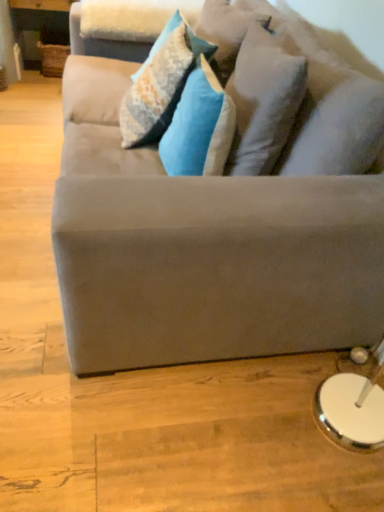
Question: Can you confirm if suede gray couch at center is thinner than textured blue pillow at center, which is the 2th pillow from right to left?

Choices:
 (A) yes
 (B) no

Answer: (B)

Question: Considering the relative sizes of suede gray couch at center and textured blue pillow at center, which is the 2th pillow from right to left, in the image provided, is suede gray couch at center bigger than textured blue pillow at center, which is the 2th pillow from right to left,?

Choices:
 (A) yes
 (B) no

Answer: (A)

Question: Is suede gray couch at center placed right next to textured blue pillow at center, which is counted as the 2th pillow, starting from the left?

Choices:
 (A) yes
 (B) no

Answer: (B)

Question: Does suede gray couch at center contain textured blue pillow at center, which is counted as the 2th pillow, starting from the left?

Choices:
 (A) yes
 (B) no

Answer: (A)

Question: Is suede gray couch at center at the left side of textured blue pillow at center, which is the 2th pillow from right to left?

Choices:
 (A) no
 (B) yes

Answer: (B)

Question: From the image's perspective, does suede gray couch at center appear lower than textured blue pillow at center, which is the 2th pillow from right to left?

Choices:
 (A) no
 (B) yes

Answer: (A)

Question: Is suede gray couch at center beside white soft pillow at upper center, which is the first pillow from right to left?

Choices:
 (A) no
 (B) yes

Answer: (A)

Question: Can you confirm if suede gray couch at center is wider than white soft pillow at upper center, which is the 3th pillow in left-to-right order?

Choices:
 (A) no
 (B) yes

Answer: (B)

Question: From the image's perspective, is suede gray couch at center located above white soft pillow at upper center, which is the first pillow from right to left?

Choices:
 (A) no
 (B) yes

Answer: (B)

Question: Is suede gray couch at center to the right of white soft pillow at upper center, which is the 3th pillow in left-to-right order, from the viewer's perspective?

Choices:
 (A) yes
 (B) no

Answer: (B)

Question: Is suede gray couch at center taller than white soft pillow at upper center, which is the 3th pillow in left-to-right order?

Choices:
 (A) yes
 (B) no

Answer: (A)

Question: Is suede gray couch at center turned away from white soft pillow at upper center, which is the first pillow from right to left?

Choices:
 (A) no
 (B) yes

Answer: (B)

Question: Would you say suede gray couch at center is part of velvet blue pillow at center, which ranks as the first pillow in left-to-right order,'s contents?

Choices:
 (A) no
 (B) yes

Answer: (A)